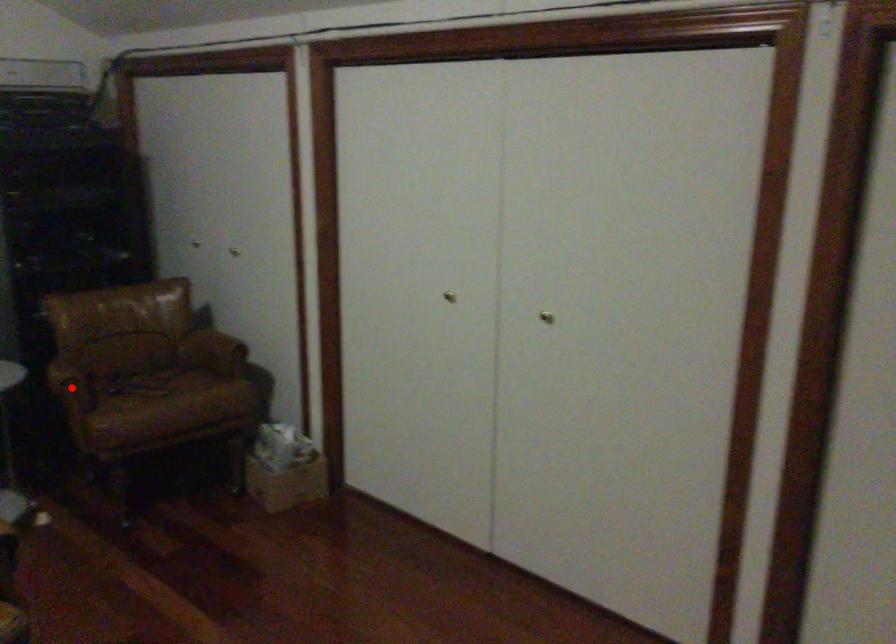
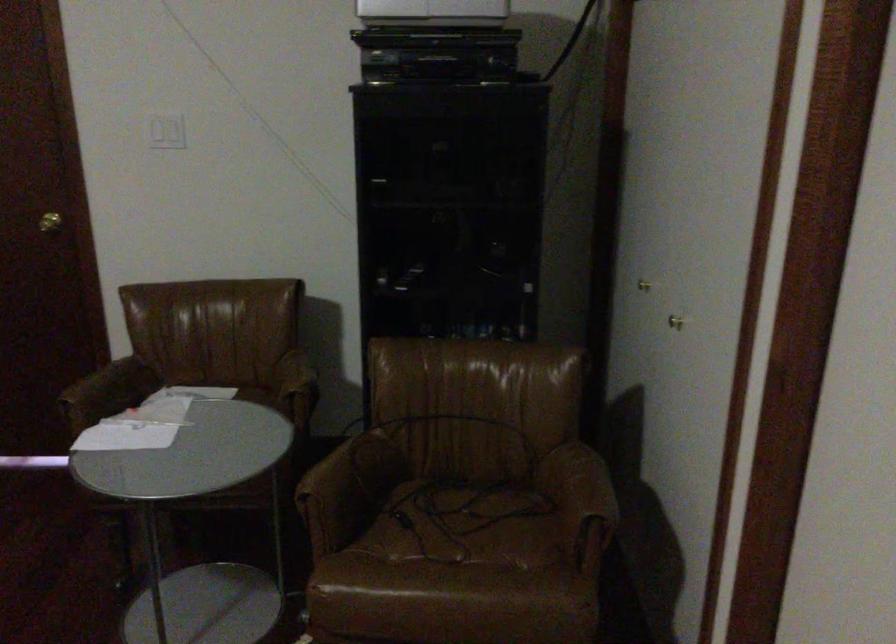
Question: I am providing you with two images of the same scene from different viewpoints. Given a red point in image1, look at the same physical point in image2. Is it:

Choices:
 (A) Closer to the viewpoint
 (B) Farther from the viewpoint

Answer: (A)